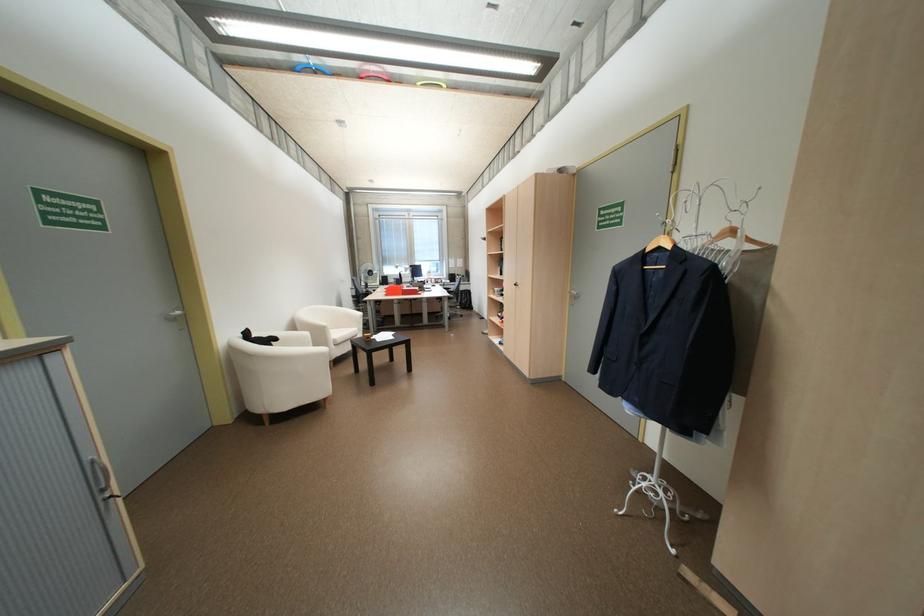
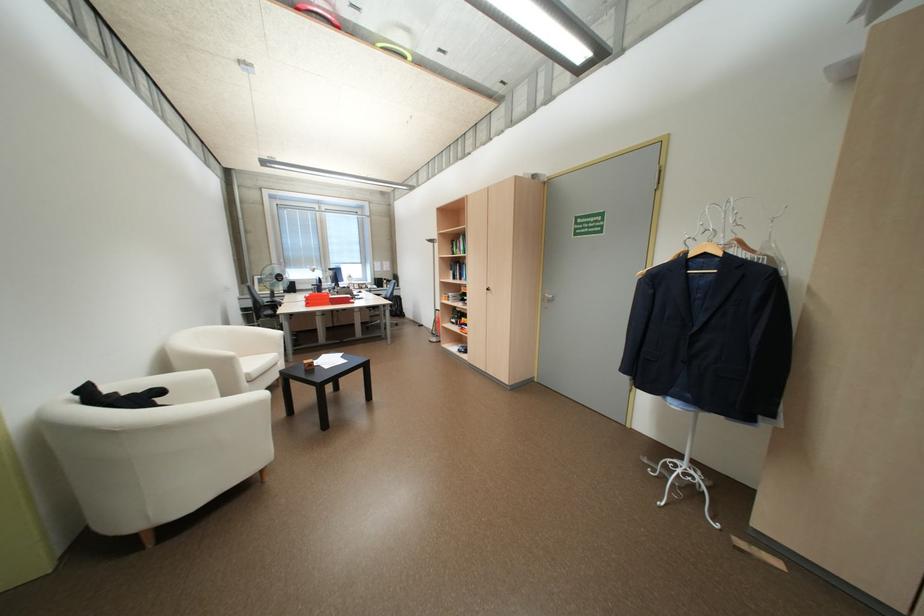
Find the pixel in the second image that matches pixel 669 248 in the first image.

(714, 254)